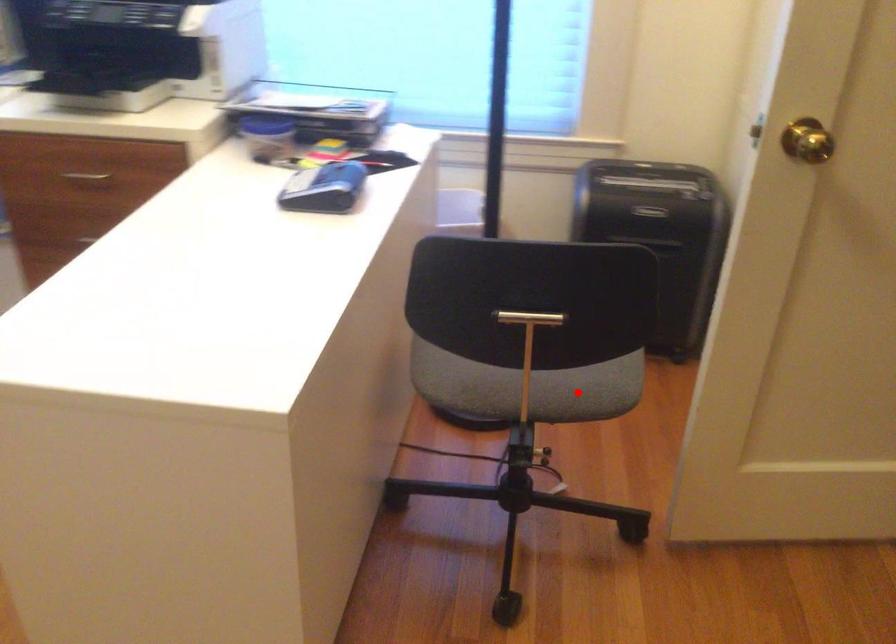
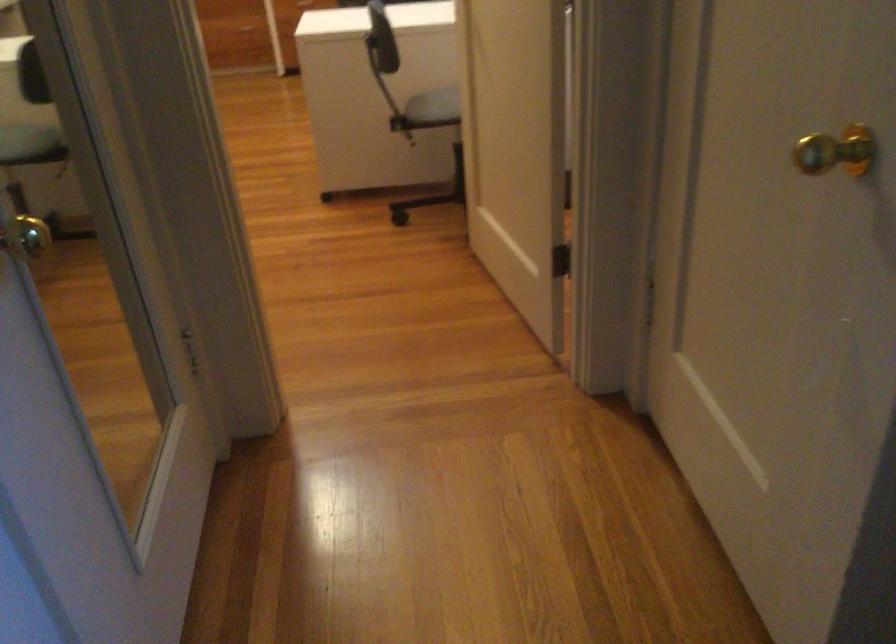
Question: I am providing you with two images of the same scene from different viewpoints. Image1 has a red point marked. In image2, the corresponding 3D location appears at what relative position? Reply with the corresponding letter.

Choices:
 (A) Closer
 (B) Farther

Answer: (B)